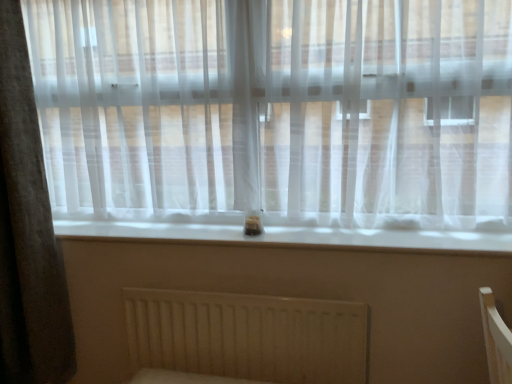
Question: Is white matte radiator at lower center facing away from gray fabric curtain at left?

Choices:
 (A) no
 (B) yes

Answer: (A)

Question: From a real-world perspective, is white matte radiator at lower center under gray fabric curtain at left?

Choices:
 (A) no
 (B) yes

Answer: (B)

Question: From the image's perspective, is white matte radiator at lower center under gray fabric curtain at left?

Choices:
 (A) no
 (B) yes

Answer: (B)

Question: Is white matte radiator at lower center touching gray fabric curtain at left?

Choices:
 (A) no
 (B) yes

Answer: (A)

Question: From a real-world perspective, is white matte radiator at lower center positioned over gray fabric curtain at left based on gravity?

Choices:
 (A) no
 (B) yes

Answer: (A)

Question: Is gray fabric curtain at left inside the boundaries of white matte radiator at lower center, or outside?

Choices:
 (A) outside
 (B) inside

Answer: (A)

Question: Considering the positions of gray fabric curtain at left and white matte radiator at lower center in the image, is gray fabric curtain at left taller or shorter than white matte radiator at lower center?

Choices:
 (A) short
 (B) tall

Answer: (B)

Question: From the image's perspective, is gray fabric curtain at left located above or below white matte radiator at lower center?

Choices:
 (A) above
 (B) below

Answer: (A)

Question: Is gray fabric curtain at left bigger or smaller than white matte radiator at lower center?

Choices:
 (A) small
 (B) big

Answer: (B)

Question: In terms of width, does gray fabric curtain at left look wider or thinner when compared to white smooth window sill at center?

Choices:
 (A) wide
 (B) thin

Answer: (B)

Question: Is gray fabric curtain at left spatially inside white smooth window sill at center, or outside of it?

Choices:
 (A) outside
 (B) inside

Answer: (A)

Question: From a real-world perspective, is gray fabric curtain at left above or below white smooth window sill at center?

Choices:
 (A) above
 (B) below

Answer: (A)

Question: Is point (19, 269) positioned closer to the camera than point (305, 221)?

Choices:
 (A) farther
 (B) closer

Answer: (B)

Question: Based on their positions, is white smooth window sill at center located to the left or right of white matte radiator at lower center?

Choices:
 (A) right
 (B) left

Answer: (A)

Question: Considering the positions of white smooth window sill at center and white matte radiator at lower center in the image, is white smooth window sill at center taller or shorter than white matte radiator at lower center?

Choices:
 (A) short
 (B) tall

Answer: (A)